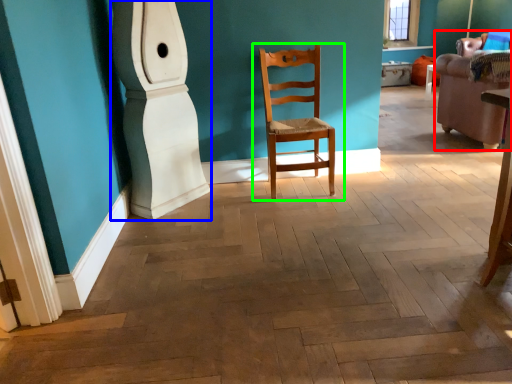
Question: Which object is the farthest from armchair (highlighted by a red box)? Choose among these: pillar (highlighted by a blue box) or chair (highlighted by a green box).

Choices:
 (A) pillar
 (B) chair

Answer: (A)